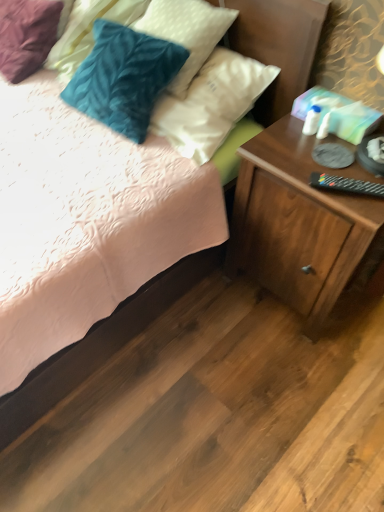
This screenshot has height=512, width=384. Identify the location of free point above wooden nightstand at lower right (from a real-world perspective). (324, 151).